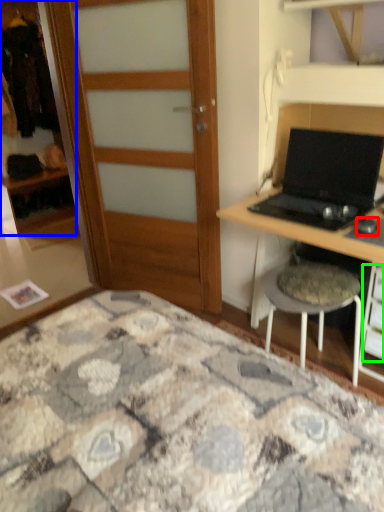
Question: Considering the real-world distances, which object is closest to mouse (highlighted by a red box)? cabinetry (highlighted by a blue box) or drawer (highlighted by a green box).

Choices:
 (A) cabinetry
 (B) drawer

Answer: (B)